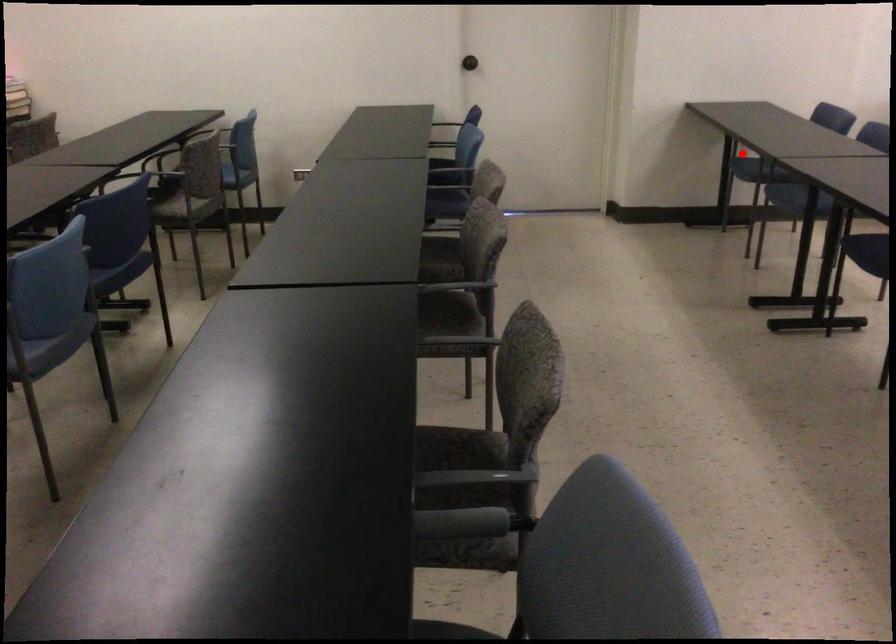
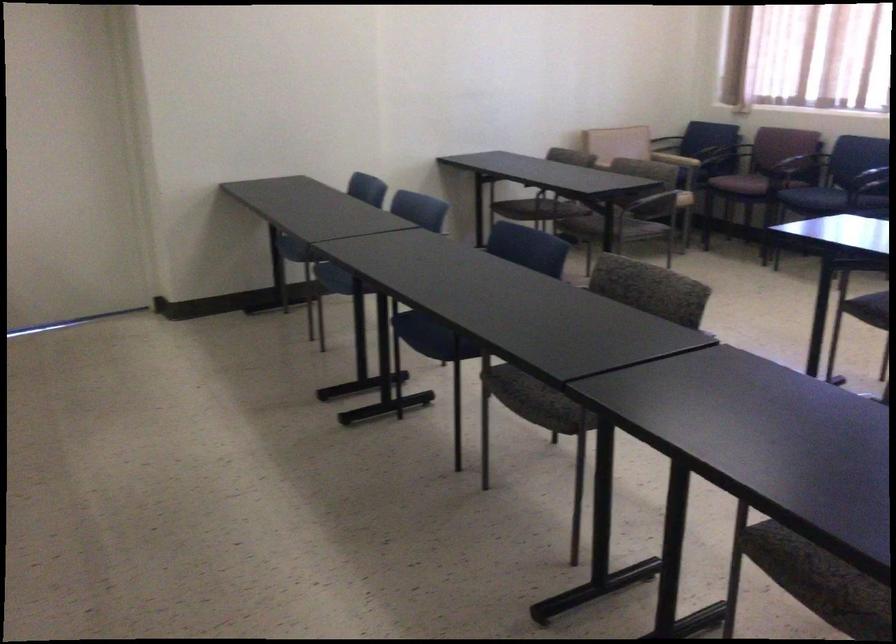
The point at the highlighted location is marked in the first image. Where is the corresponding point in the second image?

(295, 252)